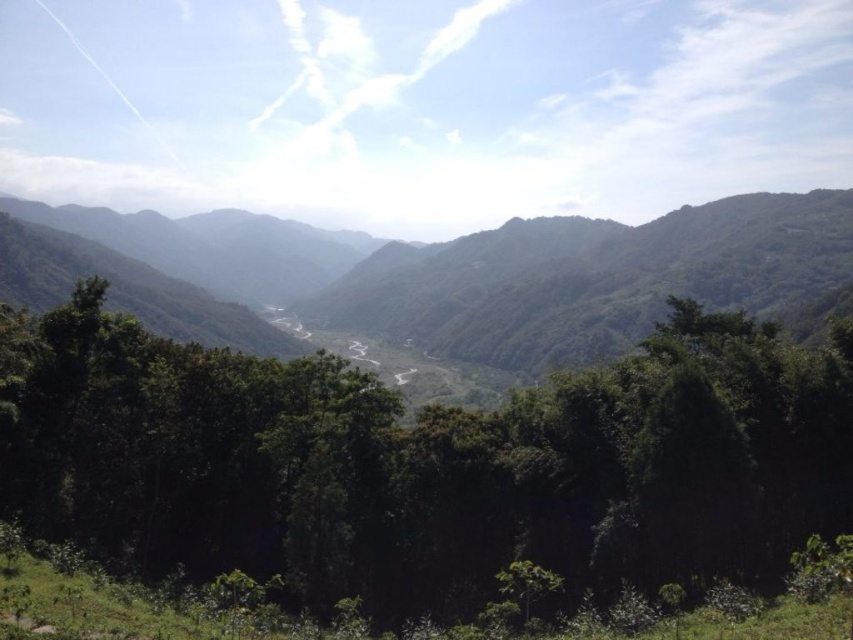
Is green leafy tree at center behind green leafy mountain at center?

That is False.

Is green leafy tree at center wider than green leafy mountain at center?

No, green leafy tree at center is not wider than green leafy mountain at center.

Between point (817, 429) and point (592, 257), which one is positioned in front?

Point (817, 429) is in front.

Identify the location of green leafy tree at center. (424, 461).